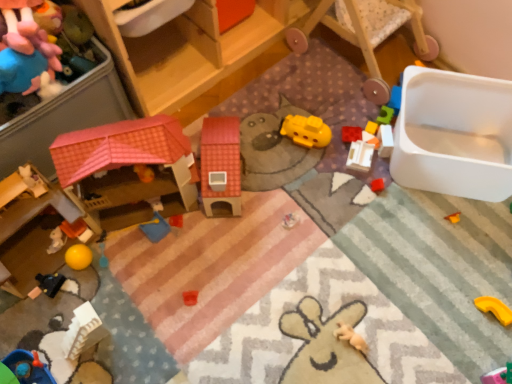
Locate an element on the screen. The height and width of the screenshot is (384, 512). vacant space behind rubber brick at upper right, placed as the 7th toy when sorted from left to right is located at coordinates (339, 100).